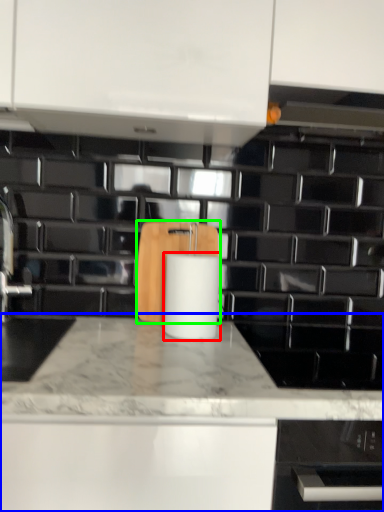
Question: Estimate the real-world distances between objects in this image. Which object is farther from paper towel (highlighted by a red box), countertop (highlighted by a blue box) or cutting board (highlighted by a green box)?

Choices:
 (A) countertop
 (B) cutting board

Answer: (A)